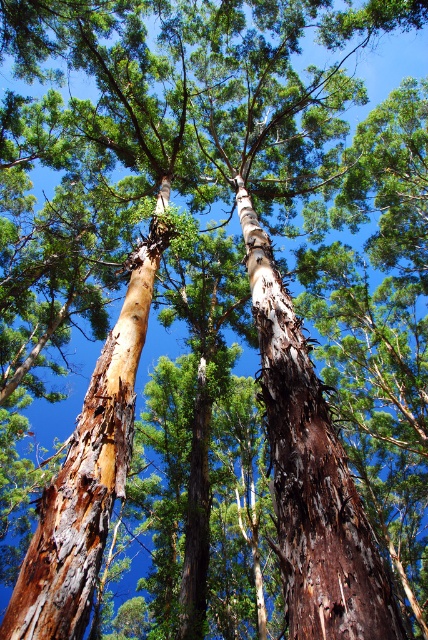
You are a bird flying over the forest and want to land on the brown rough bark at center. Based on its coordinates, can you estimate how far it is from the bottom edge of the forest canopy?

The brown rough bark at center is located at coordinates point (311, 474). The second value 0.727 represents its vertical position from the bottom edge of the image. Since the coordinate system typically ranges from 0 to 1, this means it is approximately 72.7 percent from the bottom edge, so roughly 73 percent up from the bottom.

You are a park ranger assessing tree health. You notice two tree trunks in the forest scene described. Which of the two, the brown rough bark at center or the brown rough bark at left, has a narrower trunk?

The brown rough bark at center has a lesser width compared to the brown rough bark at left, so it has a narrower trunk.